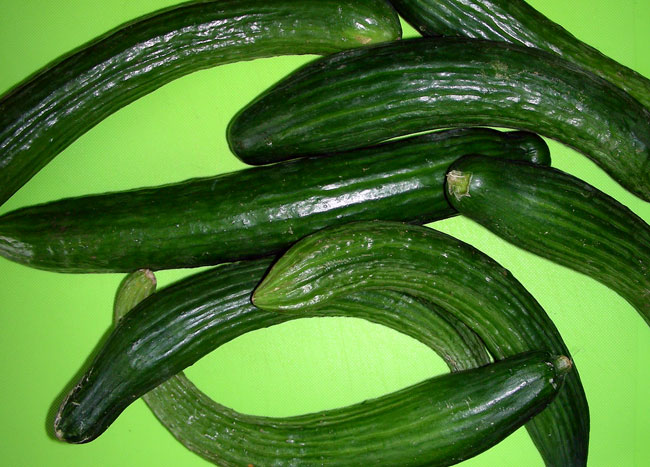
Where is `surface to place vegetables`? This screenshot has width=650, height=467. surface to place vegetables is located at coordinates (160, 127).